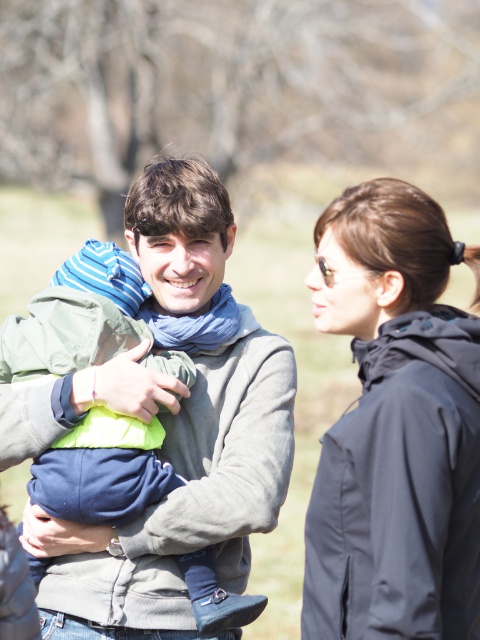
You are a photographer setting up a tripod in this scene. You need to place the tripod so that it doesn not block either the black matte jacket at right or the gray fleece sweater at center. Based on their positions, where should you position the tripod?

The black matte jacket at right is positioned under the gray fleece sweater at center, so placing the tripod between them or behind the gray fleece sweater at center would avoid blocking either.

You are a photographer trying to capture a group photo of the black matte jacket at right and the gray fleece sweater at center. To ensure both are in frame, should you adjust your camera to the left or the right?

The black matte jacket at right is to the right of the gray fleece sweater at center. To include both in the frame, you should adjust your camera to the left to capture the gray fleece sweater at center and then pan towards the right to include the black matte jacket at right, ensuring both are within the shot.

You are standing in the park and want to take a photo of the point at coordinates [432,364]. If your camera has a focal length of 50mm and you are currently 3.26 meters away, should you move closer or farther away to focus on that point?

The point at coordinates [432,364] is already 3.26 meters from the camera, so you do not need to move closer or farther away to focus on it.